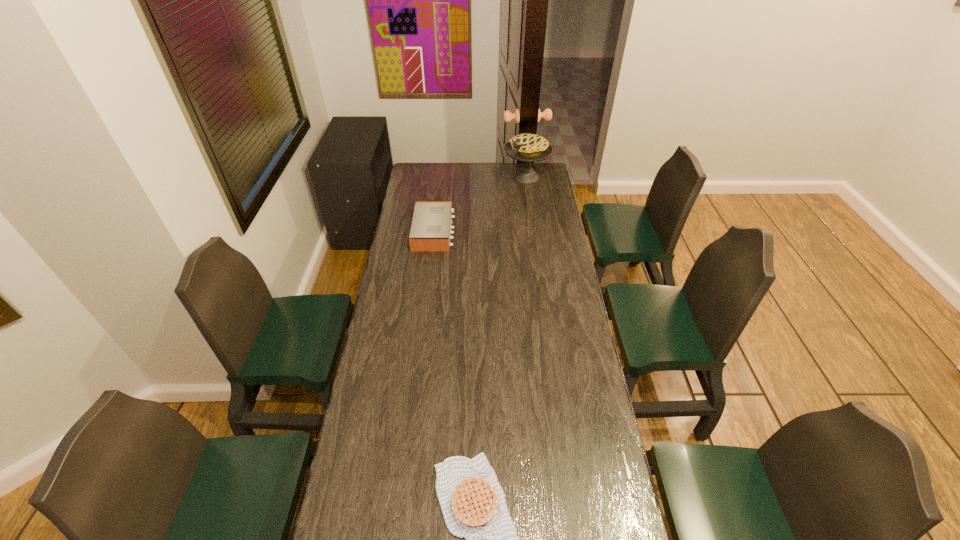
Identify the location of object that stands as the second closest to the radio receiver. Image resolution: width=960 pixels, height=540 pixels. click(473, 504).

This screenshot has width=960, height=540. I want to click on object that is the closest to the radio receiver, so click(x=526, y=147).